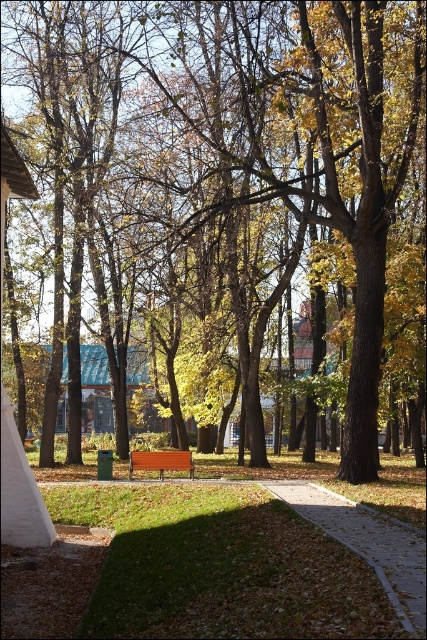
Question: Is brown concrete sidewalk at center positioned at the back of brown wooden bench at center?

Choices:
 (A) yes
 (B) no

Answer: (B)

Question: Can you confirm if brown concrete sidewalk at center is positioned below brown wooden bench at center?

Choices:
 (A) yes
 (B) no

Answer: (B)

Question: Which object appears closest to the camera in this image?

Choices:
 (A) brown wooden bench at center
 (B) brown concrete sidewalk at center

Answer: (B)

Question: Does brown concrete sidewalk at center have a larger size compared to brown wooden bench at center?

Choices:
 (A) no
 (B) yes

Answer: (B)